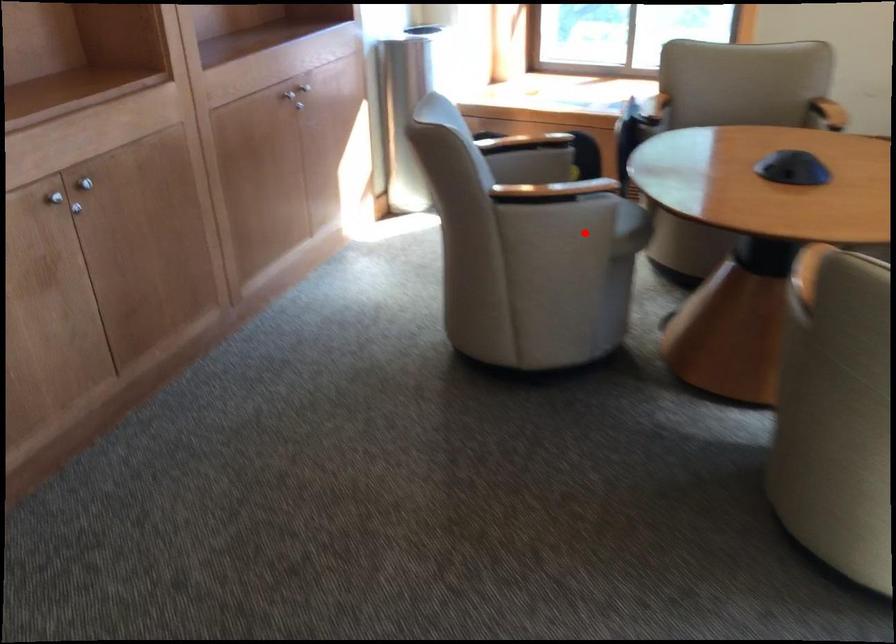
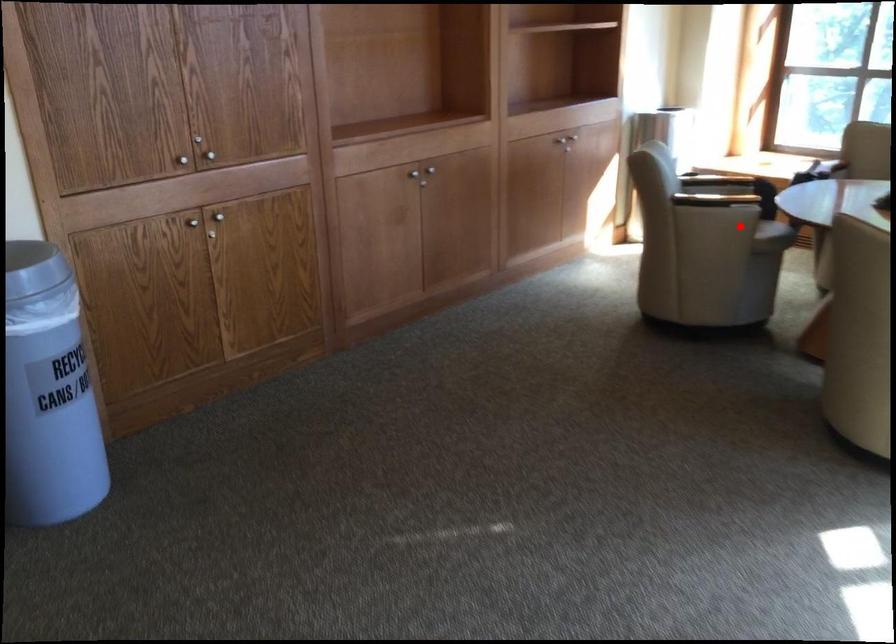
I am providing you with two images of the same scene from different viewpoints. A red point is marked on the first image and another point is marked on the second image. Is the marked point in image1 the same physical position as the marked point in image2?

Yes